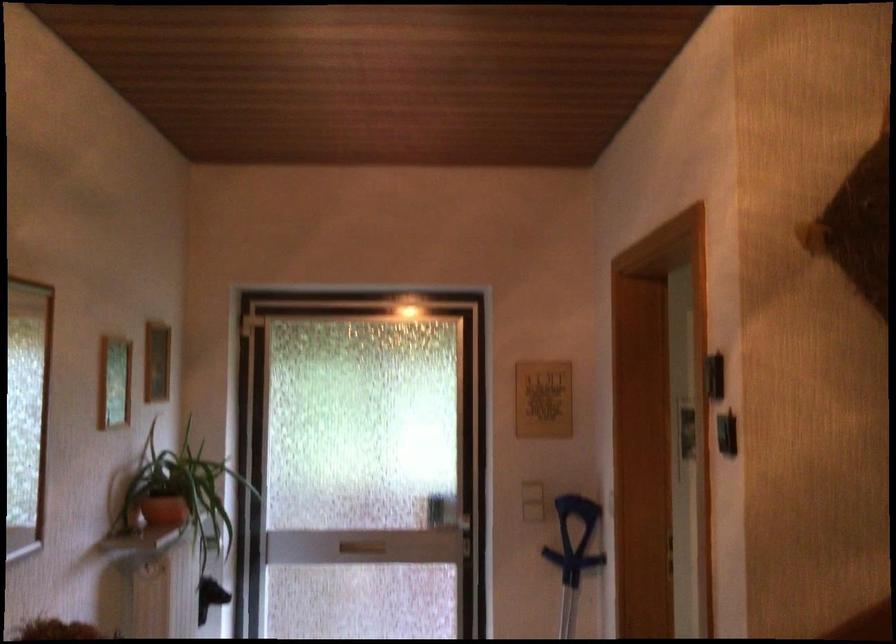
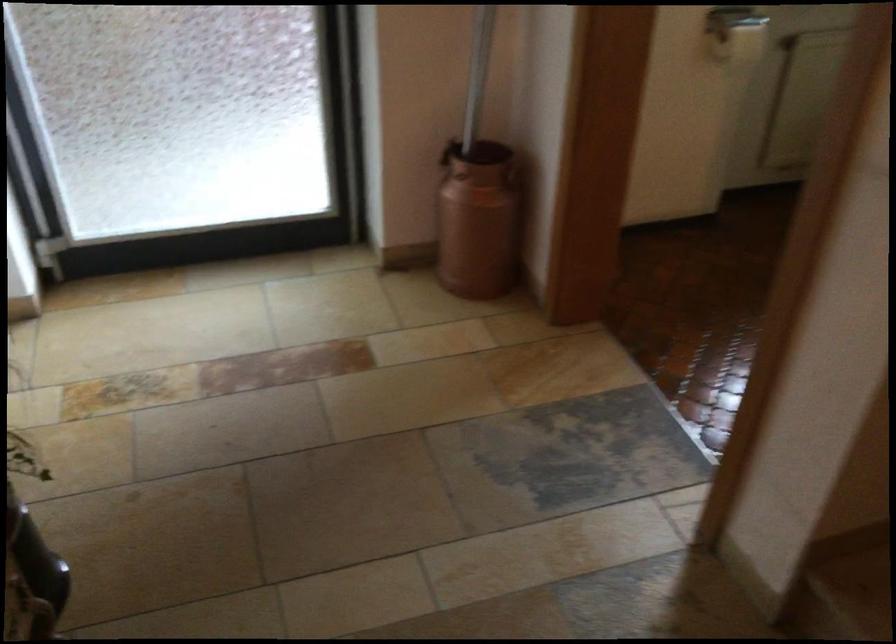
The images are taken continuously from a first-person perspective. In which direction is your viewpoint rotating?

The camera's rotation is toward right-down.